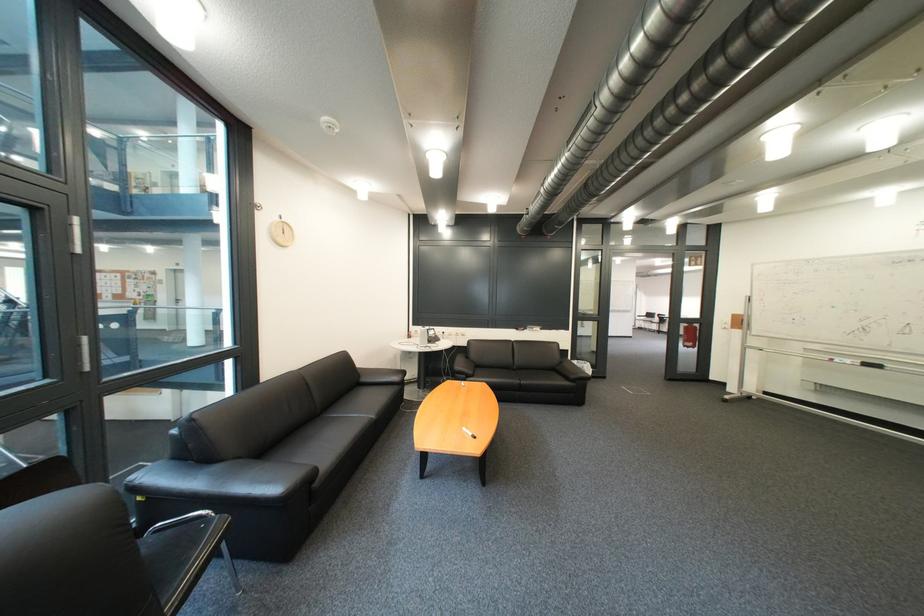
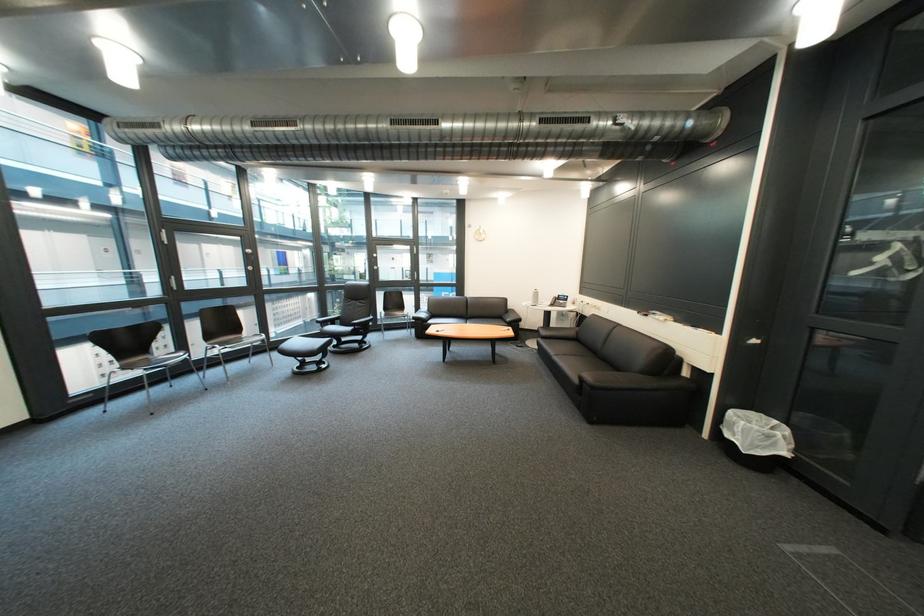
In the second image, find the point that corresponds to (600,370) in the first image.

(751, 431)